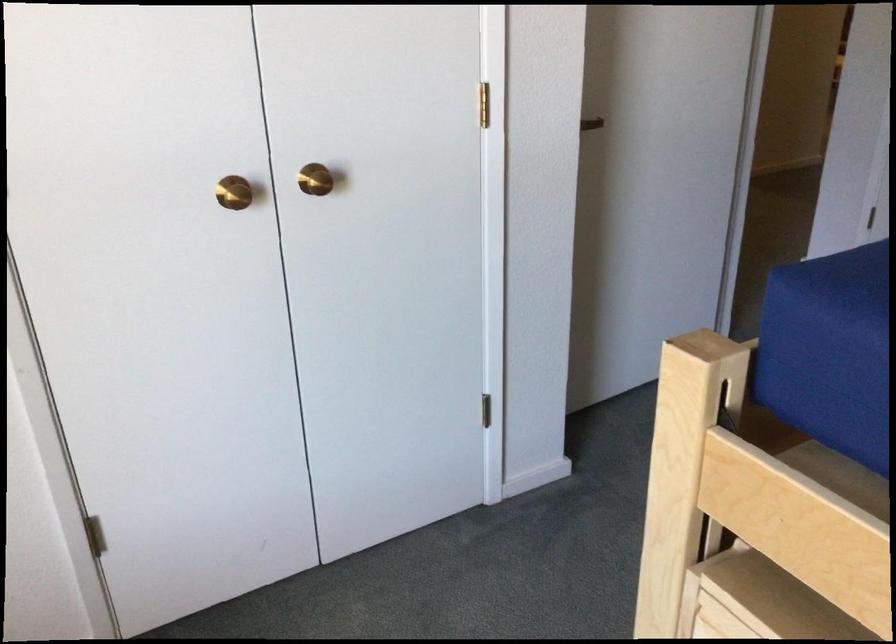
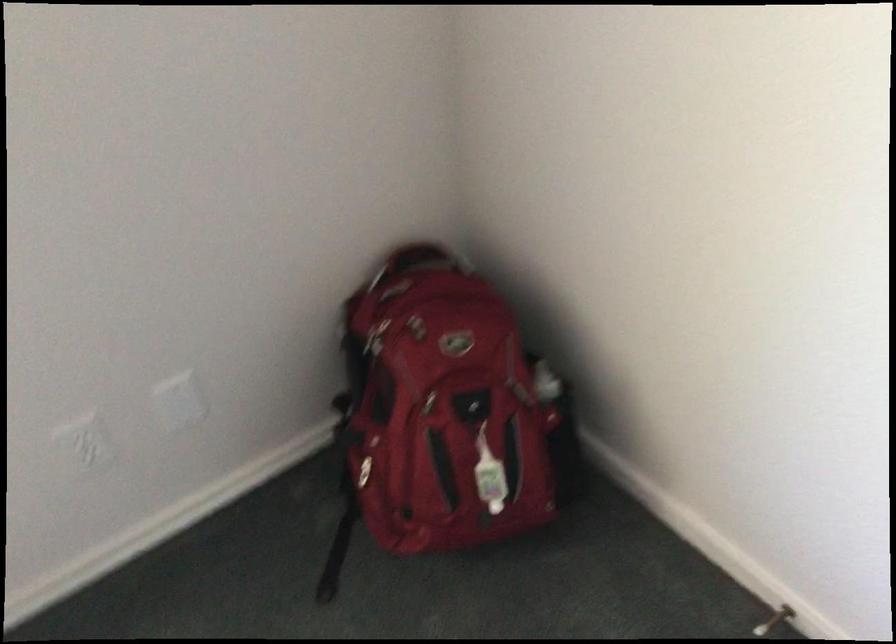
The first image is from the beginning of the video and the second image is from the end. How did the camera likely rotate when shooting the video?

The camera's rotation is toward left-down.